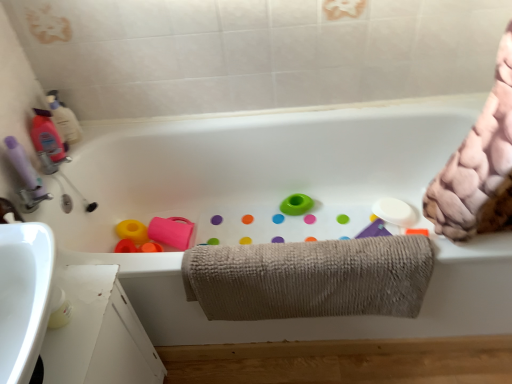
Find the location of `vacant area to the right of matte pink bottle at left, the 2th cleaning product positioned from the top`. vacant area to the right of matte pink bottle at left, the 2th cleaning product positioned from the top is located at coordinates (97, 139).